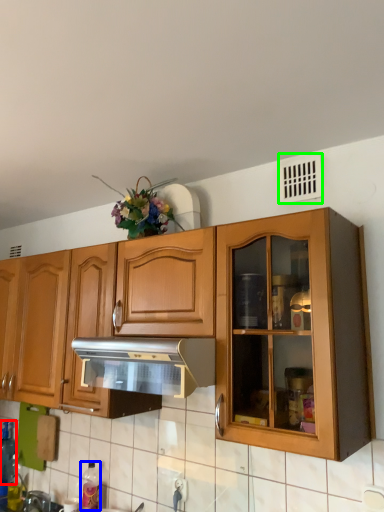
Question: Estimate the real-world distances between objects in this image. Which object is farther from bottle (highlighted by a red box), bottle (highlighted by a blue box) or window (highlighted by a green box)?

Choices:
 (A) bottle
 (B) window

Answer: (B)